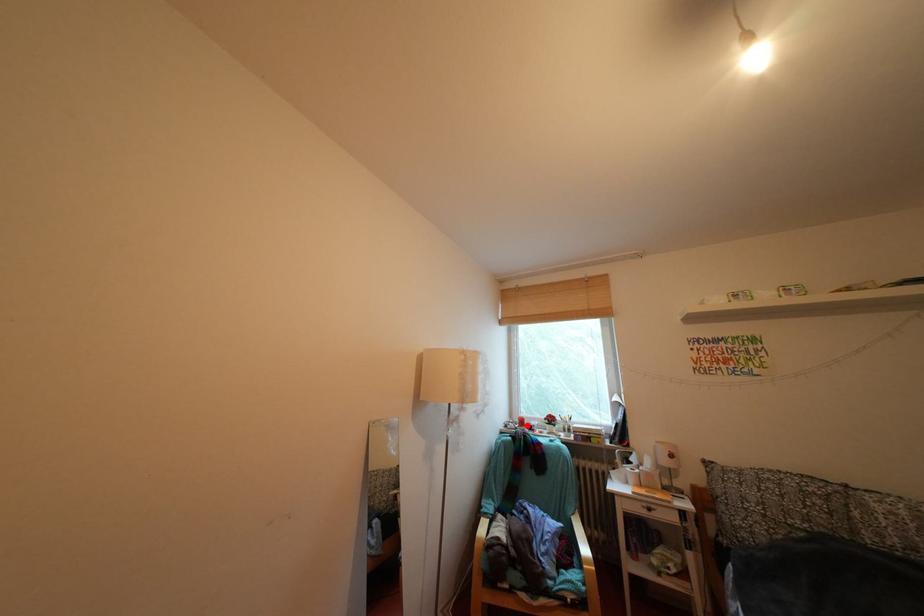
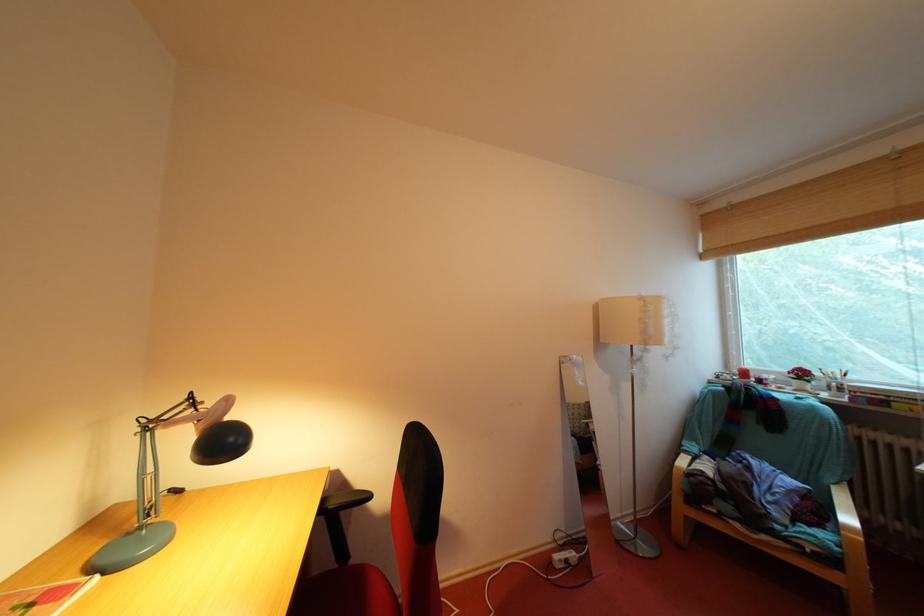
Question: I am providing you with two images of the same scene from different viewpoints. In image1, a red point is highlighted. Considering the same 3D point in image2, which of the following is correct?

Choices:
 (A) It is closer
 (B) It is farther

Answer: (A)